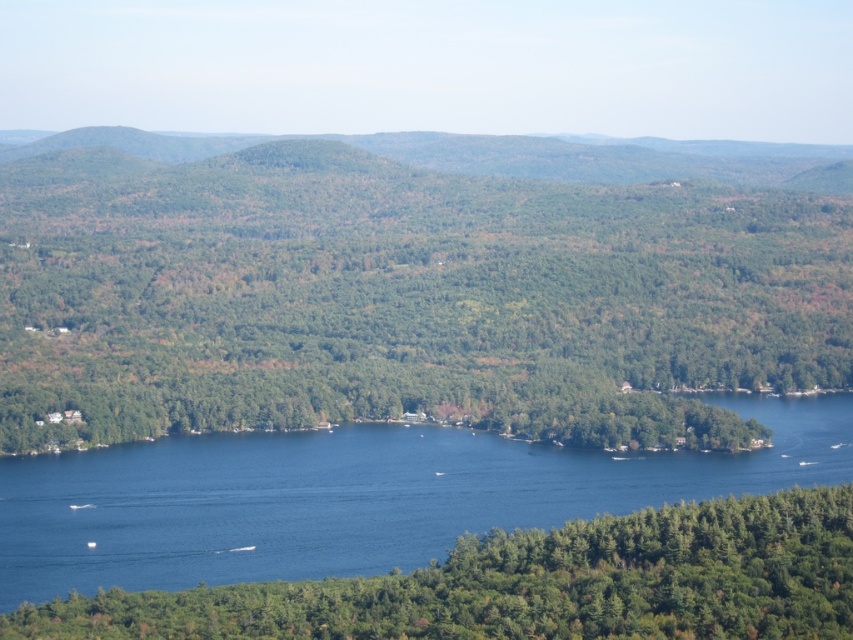
Is green matte tree at center above green matte tree at lower center?

Yes.

Who is more forward, (172,284) or (705,600)?

Positioned in front is point (705,600).

Between point (711, 300) and point (691, 563), which one is positioned behind?

The point (711, 300) is more distant.

At what (x,y) coordinates should I click in order to perform the action: click on green matte tree at center. Please return your answer as a coordinate pair (x, y). Looking at the image, I should click on (402, 298).